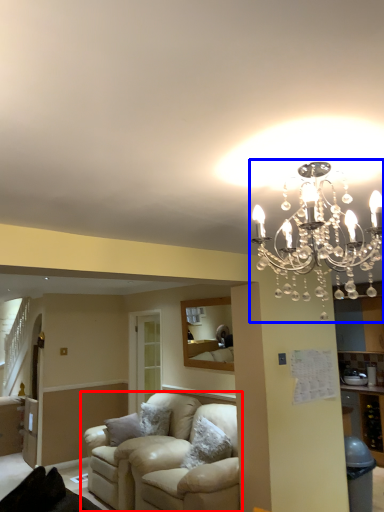
Question: Which object is further to the camera taking this photo, studio couch (highlighted by a red box) or lamp (highlighted by a blue box)?

Choices:
 (A) studio couch
 (B) lamp

Answer: (A)